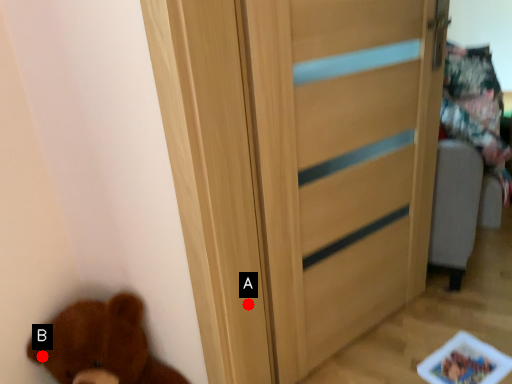
Question: Two points are circled on the image, labeled by A and B beside each circle. Which point is closer to the camera?

Choices:
 (A) A is closer
 (B) B is closer

Answer: (B)